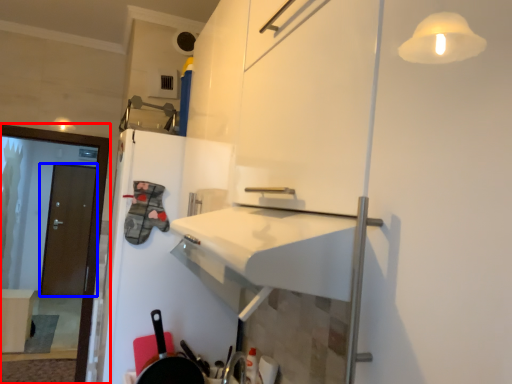
Question: Which of the following is the closest to the observer, screen door (highlighted by a red box) or door (highlighted by a blue box)?

Choices:
 (A) screen door
 (B) door

Answer: (A)